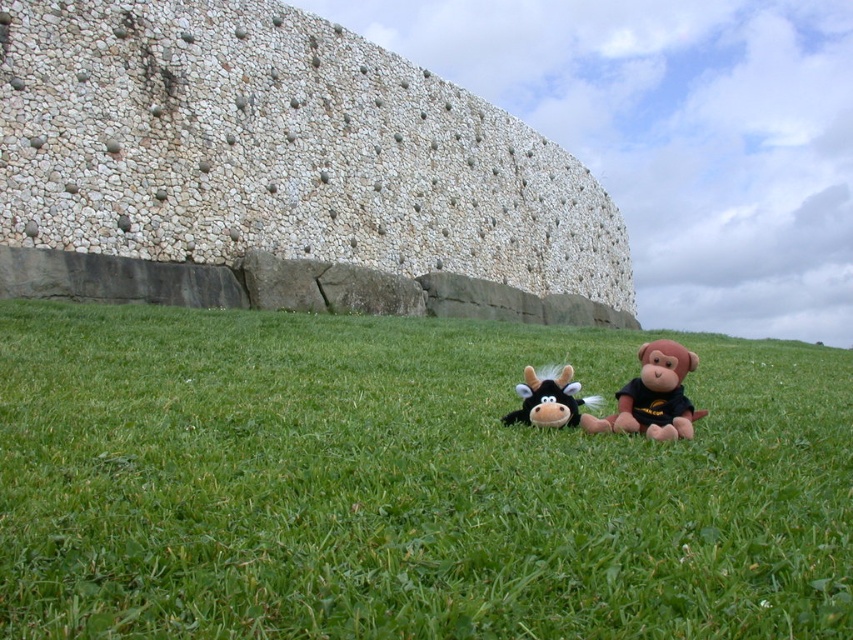
Question: Is brown plush monkey at lower right below black plush cow at center?

Choices:
 (A) no
 (B) yes

Answer: (B)

Question: Which object is closer to the camera taking this photo?

Choices:
 (A) brown plush monkey at lower right
 (B) green grass at center

Answer: (B)

Question: Which object is closer to the camera taking this photo?

Choices:
 (A) white stonework at center
 (B) brown plush monkey at lower right
 (C) black plush cow at center
 (D) green grass at center

Answer: (D)

Question: Is brown plush monkey at lower right further to camera compared to black plush cow at center?

Choices:
 (A) no
 (B) yes

Answer: (A)

Question: In this image, where is green grass at center located relative to brown plush monkey at lower right?

Choices:
 (A) left
 (B) right

Answer: (A)

Question: Among these objects, which one is farthest from the camera?

Choices:
 (A) brown plush monkey at lower right
 (B) green grass at center
 (C) white stonework at center

Answer: (C)